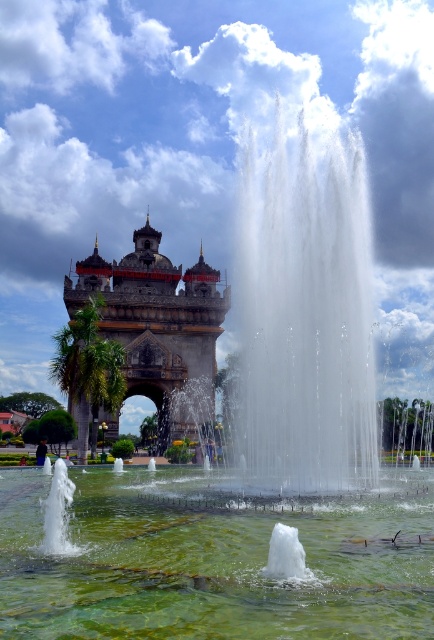
Question: Which of the following is the closest to the observer?

Choices:
 (A) (364, 497)
 (B) (167, 417)

Answer: (A)

Question: Can you confirm if green translucent water at center is smaller than polished stone arch at center?

Choices:
 (A) no
 (B) yes

Answer: (B)

Question: From the image, what is the correct spatial relationship of green translucent water at center in relation to polished stone arch at center?

Choices:
 (A) left
 (B) right

Answer: (B)

Question: Is green translucent water at center thinner than polished stone arch at center?

Choices:
 (A) yes
 (B) no

Answer: (B)